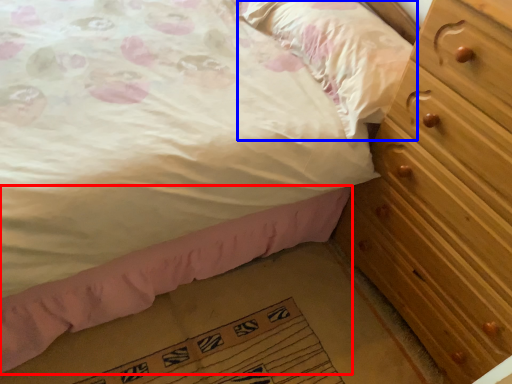
Question: Which of the following is the closest to the observer, bed frame (highlighted by a red box) or pillow (highlighted by a blue box)?

Choices:
 (A) bed frame
 (B) pillow

Answer: (A)